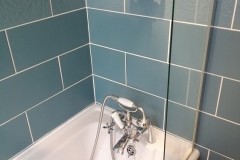
Find the location of a particular element. The width and height of the screenshot is (240, 160). left side wall of bathtub is located at coordinates (73, 151).